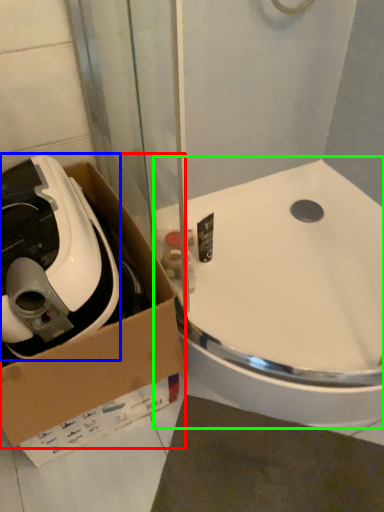
Question: Which object is the farthest from box (highlighted by a red box)? Choose among these: appliance (highlighted by a blue box) or sink (highlighted by a green box).

Choices:
 (A) appliance
 (B) sink

Answer: (B)